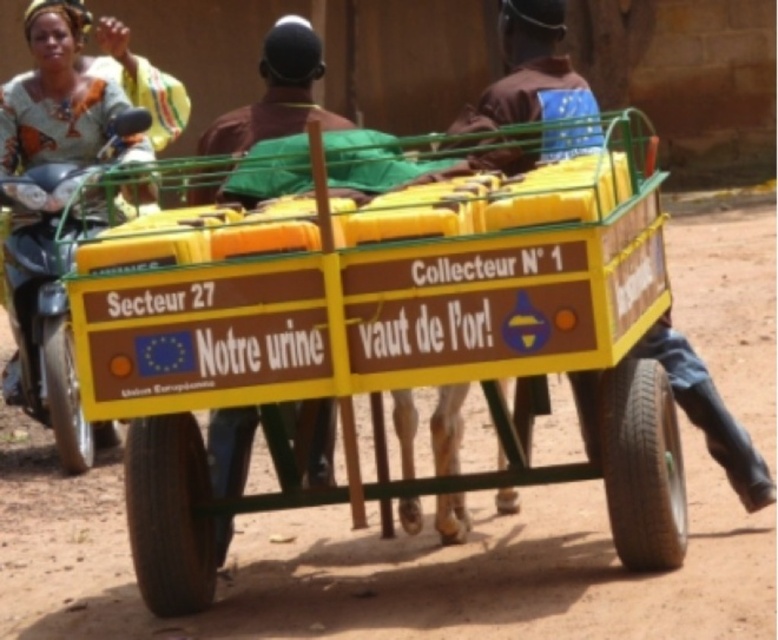
Between brown leather jacket at center and metallic silver motorcycle at left, which one is positioned lower?

metallic silver motorcycle at left is lower down.

Can you confirm if brown leather jacket at center is wider than metallic silver motorcycle at left?

In fact, brown leather jacket at center might be narrower than metallic silver motorcycle at left.

This screenshot has width=778, height=640. What are the coordinates of `brown leather jacket at center` in the screenshot? It's located at [x=528, y=72].

This screenshot has height=640, width=778. I want to click on brown leather jacket at center, so click(528, 72).

Measure the distance between yellow plastic cart at center and camera.

yellow plastic cart at center is 6.17 meters away from camera.

Which is below, yellow plastic cart at center or metallic silver motorcycle at left?

yellow plastic cart at center

Is point (535, 196) positioned behind point (58, 234)?

That is False.

What are the coordinates of `yellow plastic cart at center` in the screenshot? It's located at (384, 337).

Does yellow plastic cart at center have a lesser width compared to brown leather jacket at center?

No.

From the picture: Measure the distance between yellow plastic cart at center and brown leather jacket at center.

yellow plastic cart at center is 4.93 feet from brown leather jacket at center.

What do you see at coordinates (384, 337) in the screenshot? The width and height of the screenshot is (778, 640). I see `yellow plastic cart at center` at bounding box center [384, 337].

Where is `yellow plastic cart at center`? yellow plastic cart at center is located at coordinates (384, 337).